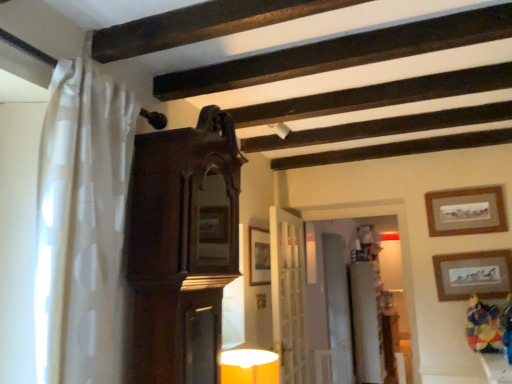
Question: Is the depth of white glossy dresser at center greater than that of wooden picture frame at center, which ranks as the 1th picture frame in left-to-right order?

Choices:
 (A) yes
 (B) no

Answer: (A)

Question: Is white glossy dresser at center closer to the viewer compared to wooden picture frame at center, acting as the third picture frame starting from the right?

Choices:
 (A) yes
 (B) no

Answer: (B)

Question: Does white glossy dresser at center contain wooden picture frame at center, which ranks as the 1th picture frame in left-to-right order?

Choices:
 (A) no
 (B) yes

Answer: (A)

Question: From the image's perspective, does white glossy dresser at center appear lower than wooden picture frame at center, which ranks as the 1th picture frame in left-to-right order?

Choices:
 (A) no
 (B) yes

Answer: (B)

Question: From a real-world perspective, is white glossy dresser at center located beneath wooden picture frame at center, which ranks as the 1th picture frame in left-to-right order?

Choices:
 (A) no
 (B) yes

Answer: (B)

Question: Would you say white wooden door at center is to the left or to the right of dark wood cabinet at center in the picture?

Choices:
 (A) right
 (B) left

Answer: (A)

Question: Is point (287, 271) closer or farther from the camera than point (188, 311)?

Choices:
 (A) closer
 (B) farther

Answer: (B)

Question: From the image's perspective, is white wooden door at center above or below dark wood cabinet at center?

Choices:
 (A) above
 (B) below

Answer: (B)

Question: Relative to dark wood cabinet at center, is white wooden door at center in front or behind?

Choices:
 (A) front
 (B) behind

Answer: (B)

Question: Does point (352, 309) appear closer or farther from the camera than point (94, 102)?

Choices:
 (A) farther
 (B) closer

Answer: (A)

Question: From a real-world perspective, is white glossy dresser at center positioned above or below white sheer curtain at left?

Choices:
 (A) above
 (B) below

Answer: (B)

Question: Is white glossy dresser at center wider or thinner than white sheer curtain at left?

Choices:
 (A) wide
 (B) thin

Answer: (B)

Question: Considering the positions of white glossy dresser at center and white sheer curtain at left in the image, is white glossy dresser at center taller or shorter than white sheer curtain at left?

Choices:
 (A) short
 (B) tall

Answer: (B)

Question: Relative to wooden picture frame at center, which ranks as the 1th picture frame in left-to-right order, is matte yellow glass table lamp at lower center in front or behind?

Choices:
 (A) front
 (B) behind

Answer: (A)

Question: Which is correct: matte yellow glass table lamp at lower center is inside wooden picture frame at center, acting as the third picture frame starting from the right, or outside of it?

Choices:
 (A) inside
 (B) outside

Answer: (B)